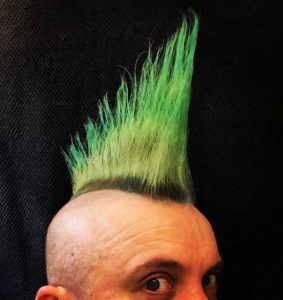
Locate an element on the screen. black blanket back drop is located at coordinates (54, 77).